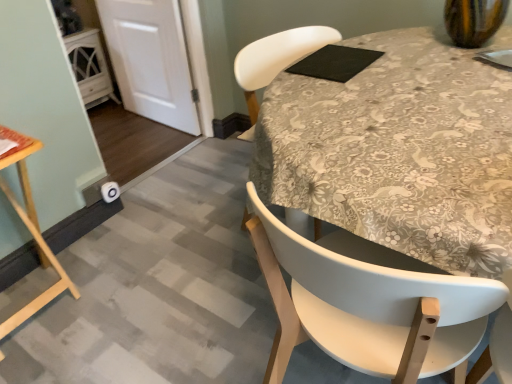
Question: Is white matte door at lower left far away from floral fabric tablecloth at center?

Choices:
 (A) no
 (B) yes

Answer: (B)

Question: From the image's perspective, does white matte door at lower left appear higher than floral fabric tablecloth at center?

Choices:
 (A) yes
 (B) no

Answer: (A)

Question: Can you confirm if white matte door at lower left is bigger than floral fabric tablecloth at center?

Choices:
 (A) yes
 (B) no

Answer: (B)

Question: Is white matte door at lower left smaller than floral fabric tablecloth at center?

Choices:
 (A) no
 (B) yes

Answer: (B)

Question: Is white matte door at lower left positioned in front of floral fabric tablecloth at center?

Choices:
 (A) no
 (B) yes

Answer: (A)

Question: Is white matte door at lower left wider than floral fabric tablecloth at center?

Choices:
 (A) no
 (B) yes

Answer: (A)

Question: Is floral fabric tablecloth at center further to the viewer compared to wooden table at lower left?

Choices:
 (A) yes
 (B) no

Answer: (A)

Question: From the image's perspective, is floral fabric tablecloth at center on top of wooden table at lower left?

Choices:
 (A) no
 (B) yes

Answer: (B)

Question: Is wooden table at lower left completely or partially inside floral fabric tablecloth at center?

Choices:
 (A) no
 (B) yes

Answer: (A)

Question: Considering the relative sizes of floral fabric tablecloth at center and wooden table at lower left in the image provided, is floral fabric tablecloth at center shorter than wooden table at lower left?

Choices:
 (A) no
 (B) yes

Answer: (A)

Question: Does floral fabric tablecloth at center have a greater width compared to wooden table at lower left?

Choices:
 (A) yes
 (B) no

Answer: (A)

Question: Is floral fabric tablecloth at center turned away from wooden table at lower left?

Choices:
 (A) no
 (B) yes

Answer: (A)

Question: Is floral fabric tablecloth at center surrounded by white matte chair at center?

Choices:
 (A) yes
 (B) no

Answer: (B)